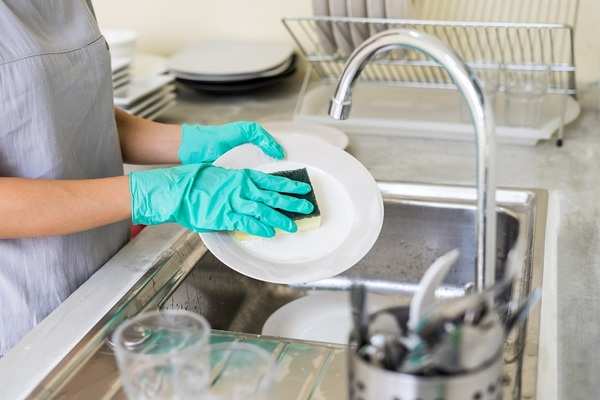
Where is `sink basin`? The width and height of the screenshot is (600, 400). sink basin is located at coordinates (402, 249), (208, 297).